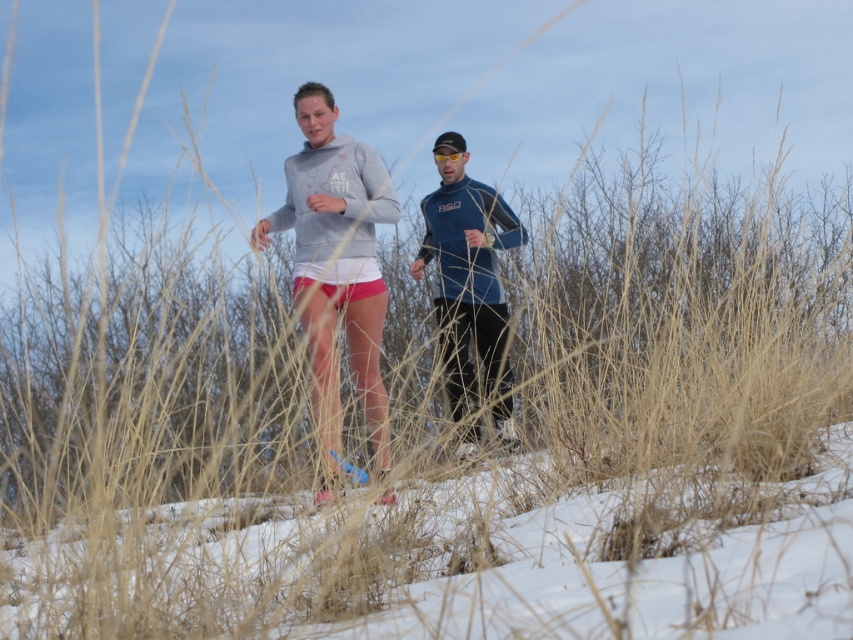
Question: Which point is closer to the camera taking this photo?

Choices:
 (A) (328, 499)
 (B) (450, 253)

Answer: (A)

Question: Which point is closer to the camera taking this photo?

Choices:
 (A) (370, 180)
 (B) (465, 392)

Answer: (A)

Question: Which object is closer to the camera taking this photo?

Choices:
 (A) matte gray hoodie at center
 (B) blue matte running suit at center

Answer: (A)

Question: Does matte gray hoodie at center appear over blue matte running suit at center?

Choices:
 (A) yes
 (B) no

Answer: (B)

Question: Is matte gray hoodie at center thinner than blue matte running suit at center?

Choices:
 (A) yes
 (B) no

Answer: (B)

Question: Does matte gray hoodie at center appear under blue matte running suit at center?

Choices:
 (A) no
 (B) yes

Answer: (B)